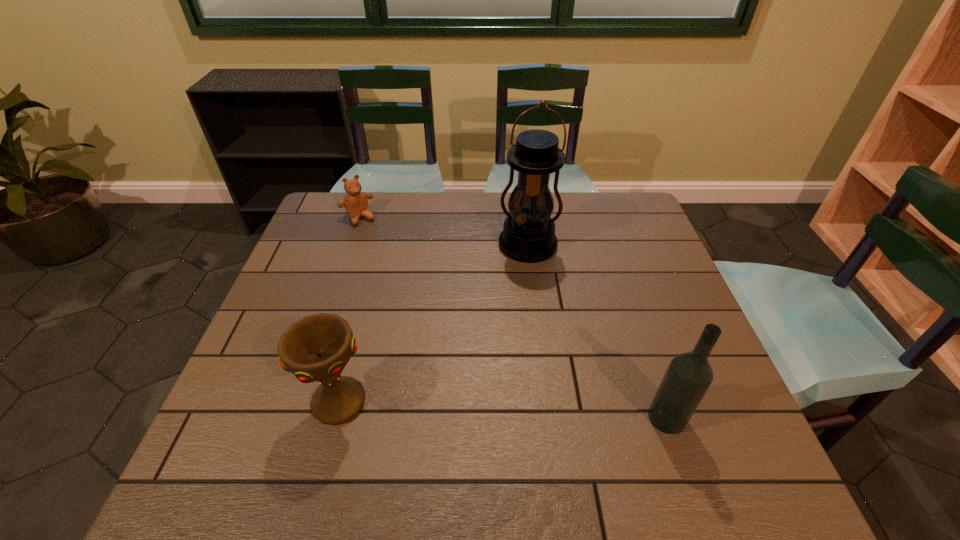
Where is `free space between the rightmost object and the tallest object`? free space between the rightmost object and the tallest object is located at coordinates (597, 332).

I want to click on vacant region between the vodka and the teddy bear, so click(x=513, y=318).

This screenshot has width=960, height=540. What are the coordinates of `free space between the lantern and the teddy bear` in the screenshot? It's located at (444, 232).

Where is `vacant area that lies between the rightmost object and the tallest object`? Image resolution: width=960 pixels, height=540 pixels. vacant area that lies between the rightmost object and the tallest object is located at coordinates (597, 332).

The width and height of the screenshot is (960, 540). What are the coordinates of `unoccupied area between the shortest object and the rightmost object` in the screenshot? It's located at (513, 318).

I want to click on free space between the third object from left to right and the teddy bear, so click(x=444, y=232).

Find the location of a particular element. vacant space that's between the lantern and the second shortest object is located at coordinates (434, 324).

Where is `vacant area that lies between the tallest object and the third shortest object`? The height and width of the screenshot is (540, 960). vacant area that lies between the tallest object and the third shortest object is located at coordinates (597, 332).

Identify which object is the third nearest to the shortest object. Please provide its 2D coordinates. Your answer should be formatted as a tuple, i.e. [(x, y)], where the tuple contains the x and y coordinates of a point satisfying the conditions above.

[(689, 375)]

Locate which object is the closest to the shortest object. Please provide its 2D coordinates. Your answer should be formatted as a tuple, i.e. [(x, y)], where the tuple contains the x and y coordinates of a point satisfying the conditions above.

[(528, 235)]